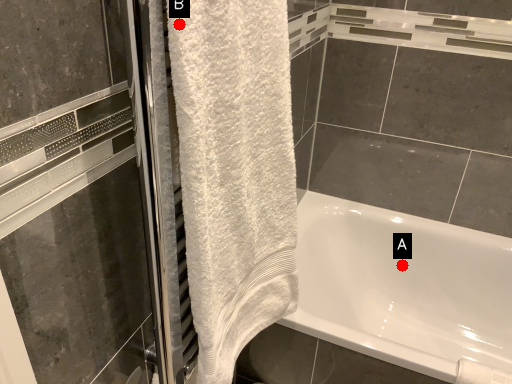
Question: Two points are circled on the image, labeled by A and B beside each circle. Which point appears farthest from the camera in this image?

Choices:
 (A) A is further
 (B) B is further

Answer: (A)